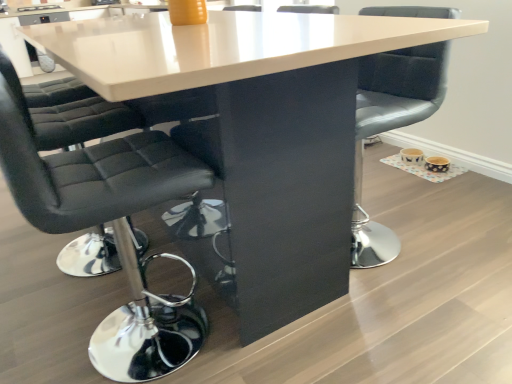
This screenshot has height=384, width=512. Find the location of `vacant space behind matte gray cushioned chair at center, which appears as the 1th chair when viewed from the right`. vacant space behind matte gray cushioned chair at center, which appears as the 1th chair when viewed from the right is located at coordinates (387, 194).